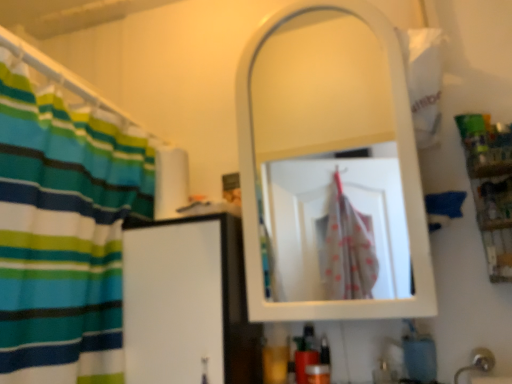
Question: Considering the positions of wooden shelf at right and white glossy mirror at upper center in the image, is wooden shelf at right wider or thinner than white glossy mirror at upper center?

Choices:
 (A) thin
 (B) wide

Answer: (A)

Question: From a real-world perspective, is wooden shelf at right above or below white glossy mirror at upper center?

Choices:
 (A) above
 (B) below

Answer: (B)

Question: Which of these objects is positioned farthest from the wooden shelf at right?

Choices:
 (A) blue matte soap at lower right
 (B) silver metallic faucet at lower right
 (C) white glossy mirror at upper center

Answer: (C)

Question: Which object is positioned closest to the white glossy mirror at upper center?

Choices:
 (A) silver metallic faucet at lower right
 (B) blue matte soap at lower right
 (C) wooden shelf at right

Answer: (C)